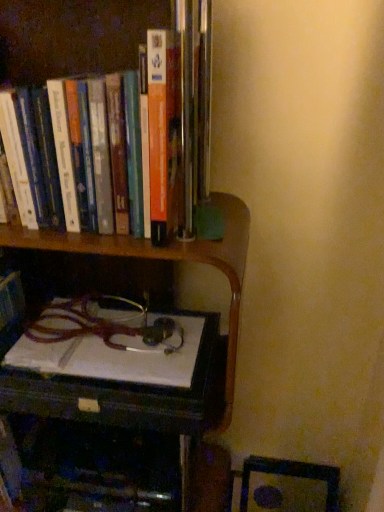
Question: Considering the positions of wooden bookcase at upper left and hardcover books at upper left in the image, is wooden bookcase at upper left bigger or smaller than hardcover books at upper left?

Choices:
 (A) big
 (B) small

Answer: (A)

Question: From their relative heights in the image, would you say wooden bookcase at upper left is taller or shorter than hardcover books at upper left?

Choices:
 (A) tall
 (B) short

Answer: (A)

Question: Which is nearer to the wooden table at lower left?

Choices:
 (A) hardcover books at upper left
 (B) wooden bookcase at upper left
 (C) wooden desk at lower center

Answer: (B)

Question: Which is farther from the wooden desk at lower center?

Choices:
 (A) wooden bookcase at upper left
 (B) hardcover books at upper left
 (C) wooden table at lower left

Answer: (B)